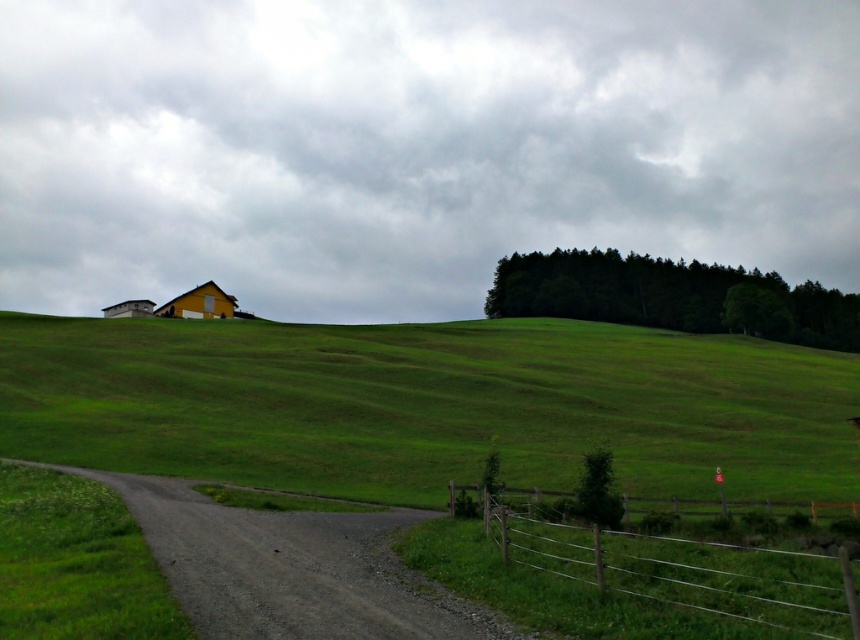
You are standing at the point with coordinates point (643, 544) and want to walk to the point with coordinates point (793, 470). Given the terrain in the scene, will you be able to see the destination point from your current position?

Point (793, 470) is behind point (643, 544), so you will not be able to see the destination point from your current position.

You are a hiker standing at the wooden fence at lower right and want to reach the green grassy hillside at center. Which direction should you move to get there?

The green grassy hillside at center is positioned on the left side of the wooden fence at lower right, so you should move to the left to reach it.

Looking at this image, you are standing at the center of the dirt road in the rural landscape. There is a point marked at coordinates point (521,385). Can you walk to that point without leaving the dirt road?

The point (521,385) is 72.83 meters away from the viewer, so yes, you can walk to that point without leaving the dirt road as it is within a reachable distance along the road.